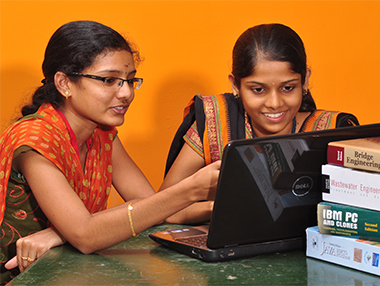
This screenshot has width=380, height=286. Identify the location of laptop computer. point(245,198), point(169,268).